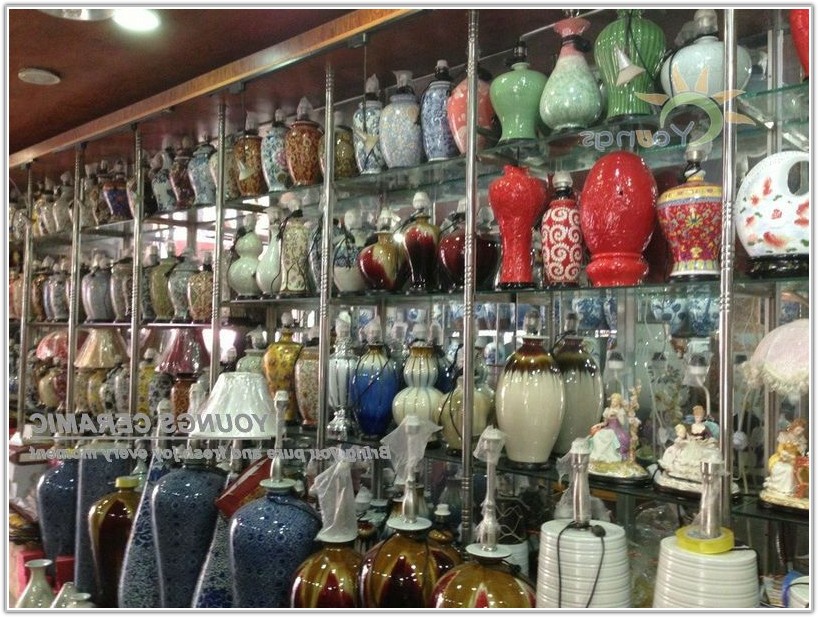
Where is `red urns`? red urns is located at coordinates (627, 184), (514, 212).